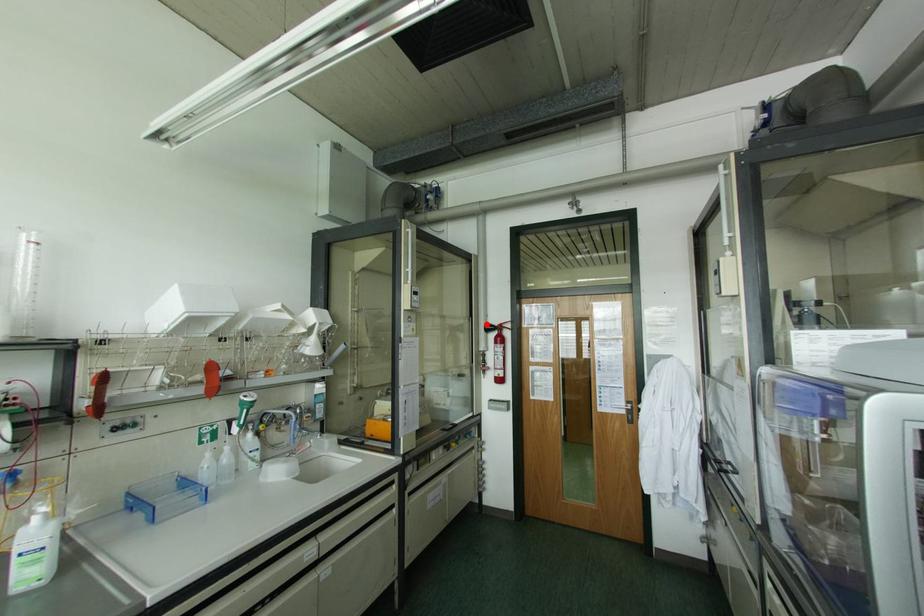
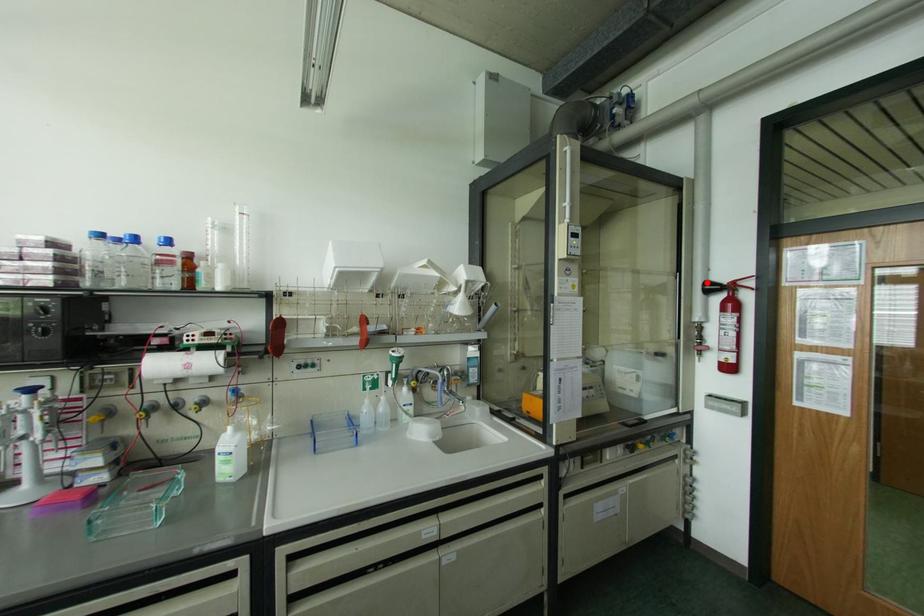
I am providing you with two images of the same scene from different viewpoints. A red point is marked on the first image and another point is marked on the second image. Do the highlighted points in image1 and image2 indicate the same real-world spot?

Yes